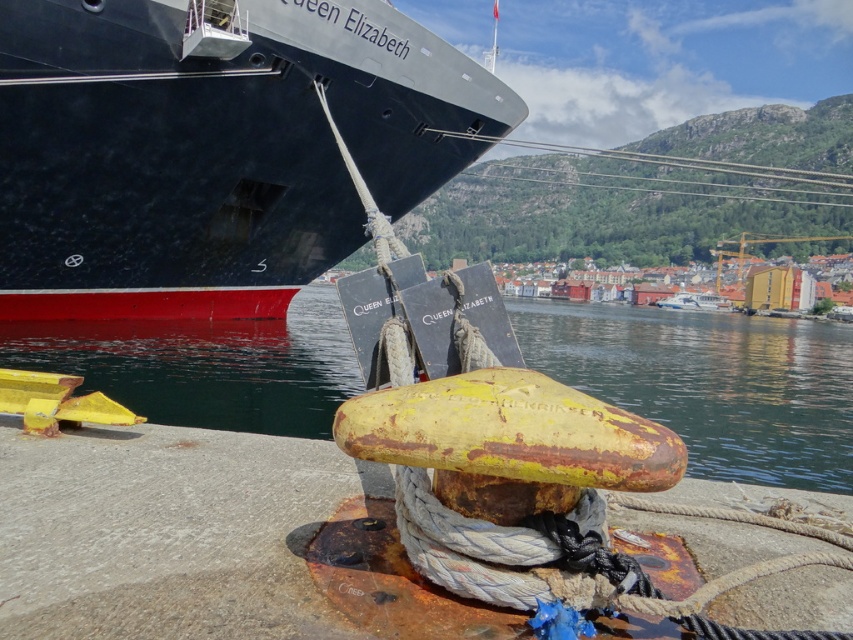
Is shiny black ship at upper left to the left of yellow rusty water at lower center from the viewer's perspective?

Correct, you'll find shiny black ship at upper left to the left of yellow rusty water at lower center.

How distant is shiny black ship at upper left from yellow rusty water at lower center?

shiny black ship at upper left and yellow rusty water at lower center are 33.30 feet apart from each other.

Who is more distant from viewer, [149,8] or [613,321]?

The point [613,321] is more distant.

Find the location of a particular element. shiny black ship at upper left is located at coordinates (213, 147).